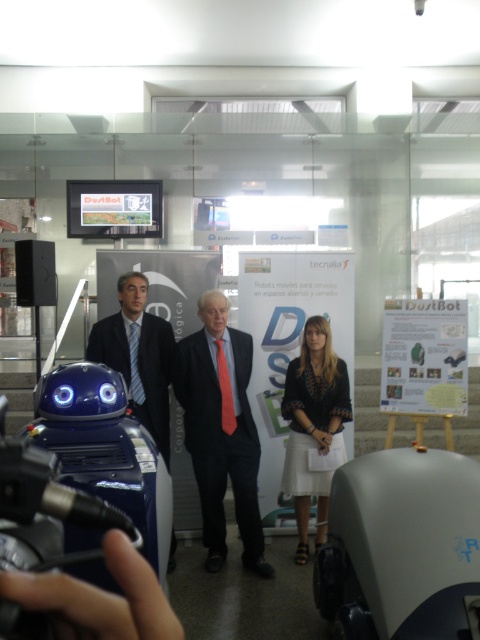
You are organizing a fashion show and need to arrange the matte black suit at center and the blue silk suit at center on a mannequin. Which suit should you choose if you want the one that appears bigger?

The matte black suit at center has a larger size compared to the blue silk suit at center, so you should choose the matte black suit at center.